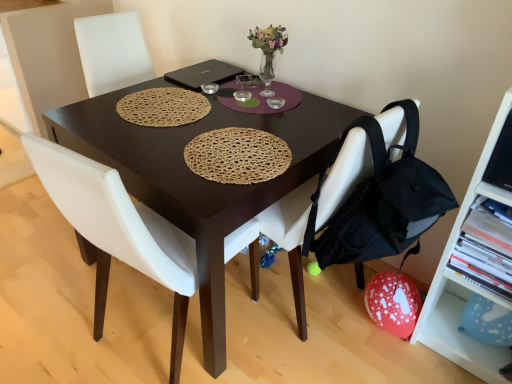
Question: Does point (501, 357) appear closer or farther from the camera than point (399, 185)?

Choices:
 (A) closer
 (B) farther

Answer: (B)

Question: Is blue paper balloon at lower right, which is counted as the 3th shelf, starting from the top, inside or outside of black fabric backpack at lower right?

Choices:
 (A) inside
 (B) outside

Answer: (B)

Question: Which of these objects is positioned farthest from the dark brown wooden desk at center?

Choices:
 (A) white fabric chair at center, positioned as the second chair in left-to-right order
 (B) white plastic chair at center, marked as the 2th chair in a right-to-left arrangement
 (C) white plastic shelf at right, the 2th shelf ordered from the bottom
 (D) black fabric backpack at lower right
 (E) blue paper balloon at lower right, which is counted as the 3th shelf, starting from the top

Answer: (E)

Question: Which object is the farthest from the blue paper balloon at lower right, which is counted as the 3th shelf, starting from the top?

Choices:
 (A) white plastic chair at center, acting as the 1th chair starting from the left
 (B) black fabric backpack at lower right
 (C) translucent glass vase at upper center
 (D) white plastic shelf at right, the first shelf viewed from the top
 (E) white fabric chair at center, which is counted as the first chair, starting from the right

Answer: (C)